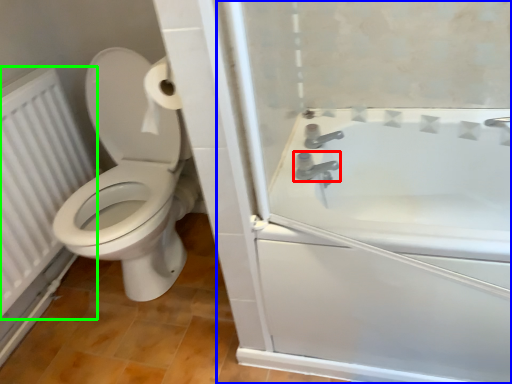
Question: Which is nearer to the tap (highlighted by a red box)? screen door (highlighted by a blue box) or radiator (highlighted by a green box).

Choices:
 (A) screen door
 (B) radiator

Answer: (A)